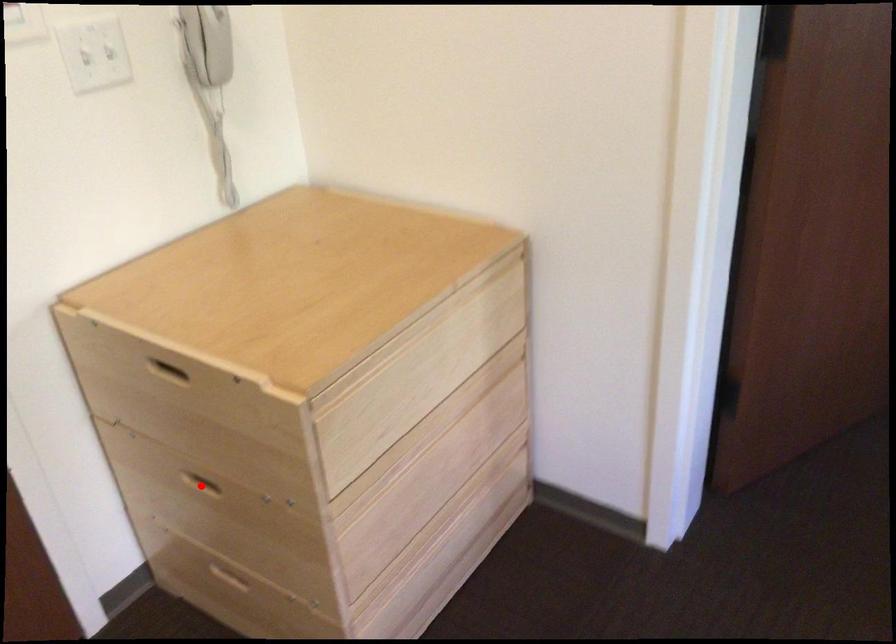
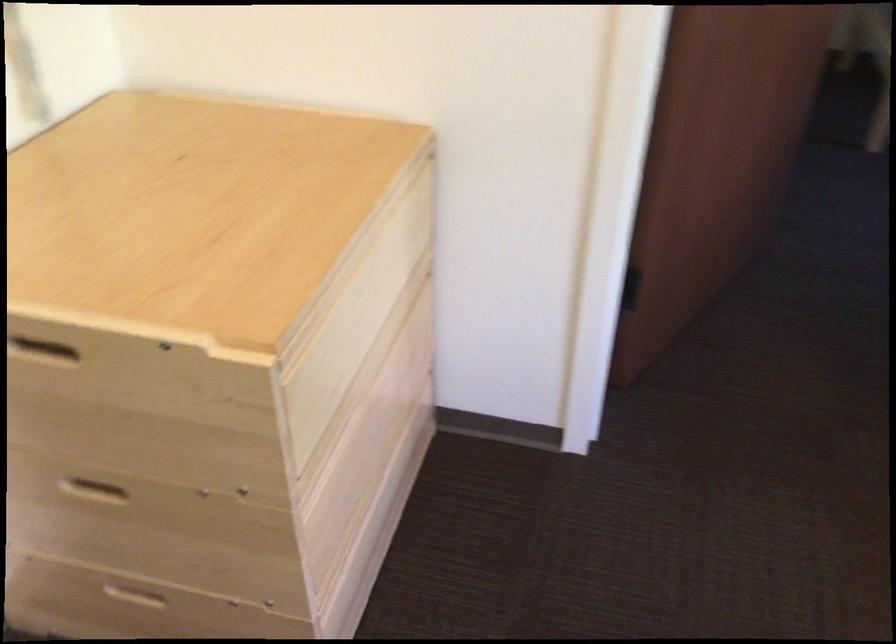
Question: I am providing you with two images of the same scene from different viewpoints. Given a red point in image1, look at the same physical point in image2. Is it:

Choices:
 (A) Closer to the viewpoint
 (B) Farther from the viewpoint

Answer: (A)